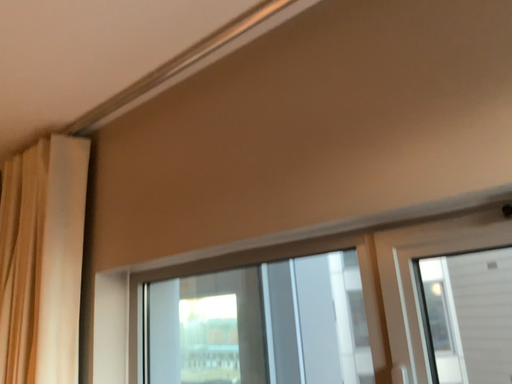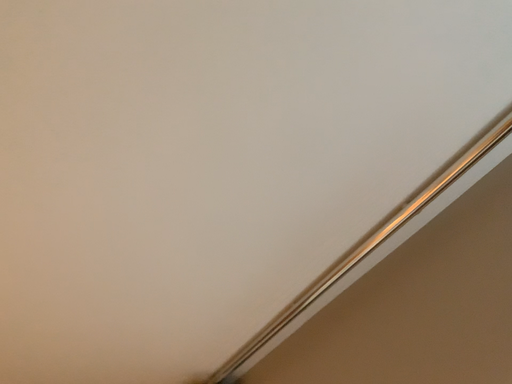
Question: Which way did the camera rotate in the video?

Choices:
 (A) rotated right
 (B) rotated left

Answer: (B)